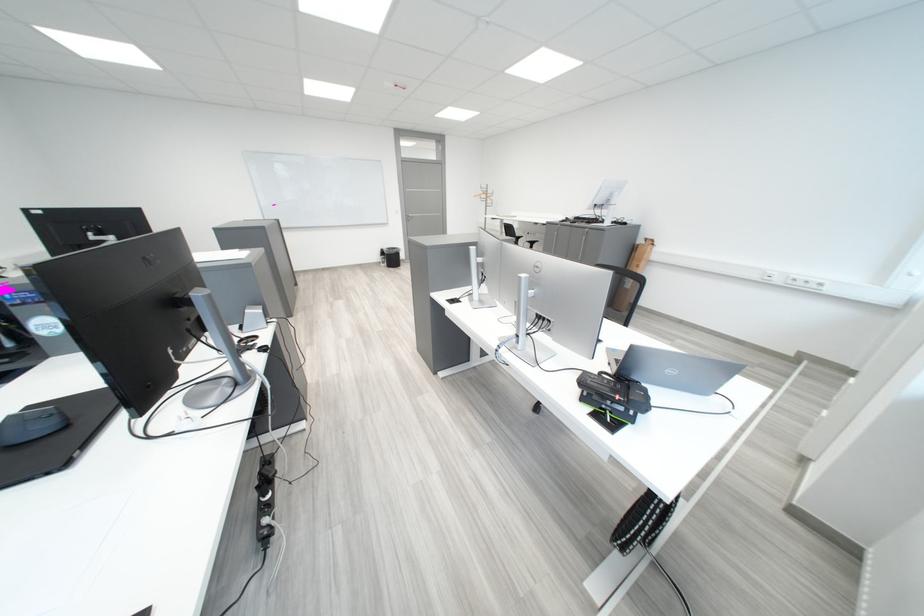
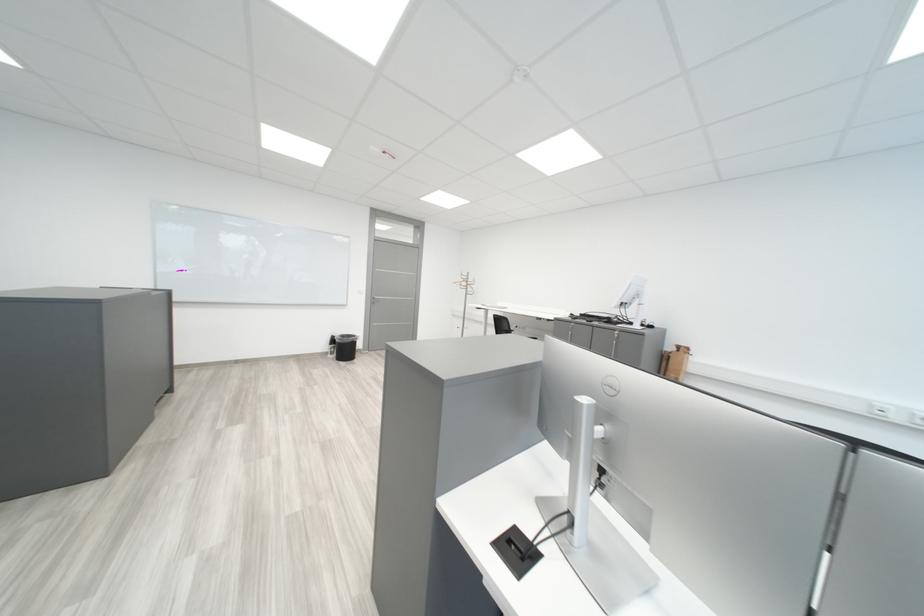
The point at [769,278] is marked in the first image. Where is the corresponding point in the second image?

(870, 410)